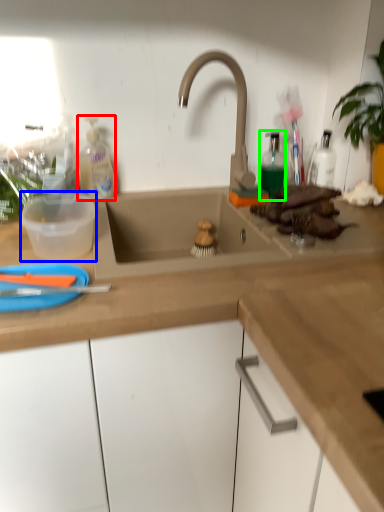
Question: Which is farther away from cleaning product (highlighted by a red box)? basin (highlighted by a blue box) or bottle (highlighted by a green box)?

Choices:
 (A) basin
 (B) bottle

Answer: (B)